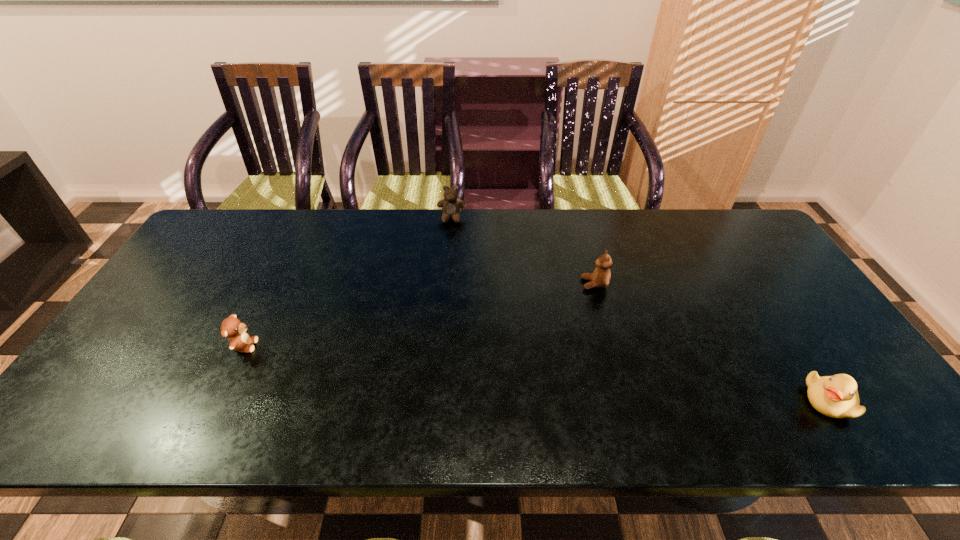
The image size is (960, 540). In order to click on vacant space located at the face of the third object from left to right in this screenshot , I will do `click(547, 284)`.

Locate an element on the screen. vacant region located 0.090m at the face of the third object from left to right is located at coordinates (551, 284).

Locate an element on the screen. The image size is (960, 540). vacant space located on the face of the leftmost object is located at coordinates (398, 346).

Locate an element on the screen. The width and height of the screenshot is (960, 540). vacant region located on the beak of the nearest object is located at coordinates (745, 401).

Locate an element on the screen. The height and width of the screenshot is (540, 960). free location located on the beak of the nearest object is located at coordinates (749, 401).

Identify the location of vacant space located on the beak of the nearest object. This screenshot has height=540, width=960. (757, 401).

You are a GUI agent. You are given a task and a screenshot of the screen. Output one action in this format:
    pyautogui.click(x=<x>, y=<y>)
    Task: Click on the object positioned at the far edge
    
    Given the screenshot: What is the action you would take?
    pyautogui.click(x=451, y=206)

Where is `object that is at the near edge`? object that is at the near edge is located at coordinates (836, 396).

Where is `object at the right edge`? The height and width of the screenshot is (540, 960). object at the right edge is located at coordinates (836, 396).

Locate an element on the screen. object positioned at the near right corner is located at coordinates (836, 396).